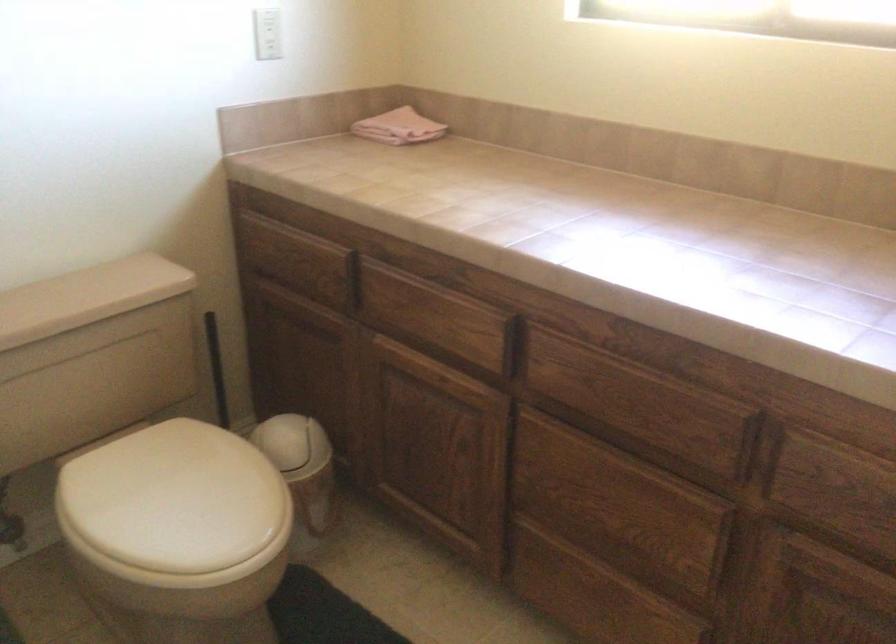
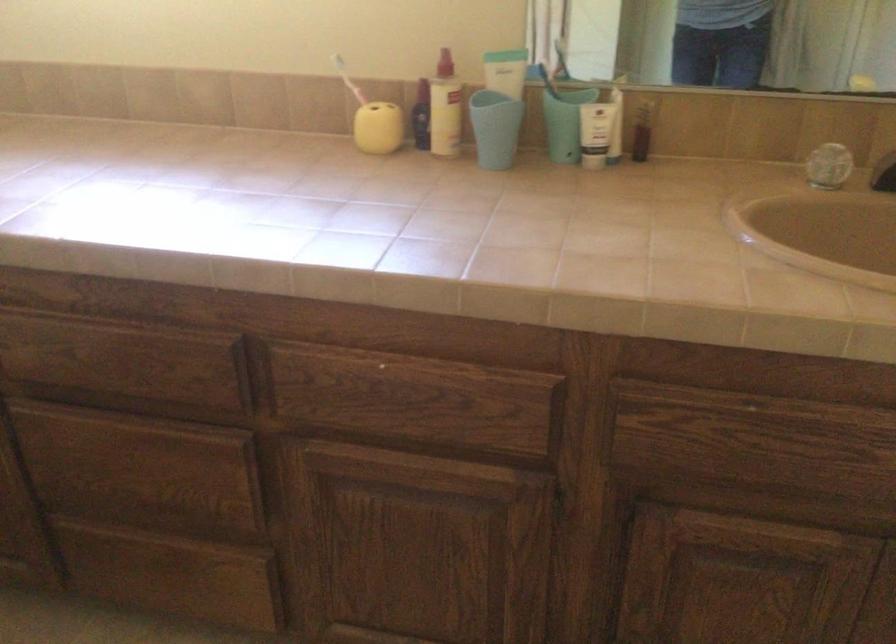
Question: Based on the continuous images, in which direction is the camera rotating? Reply with the corresponding letter.

Choices:
 (A) Left
 (B) Right
 (C) Up
 (D) Down

Answer: (B)